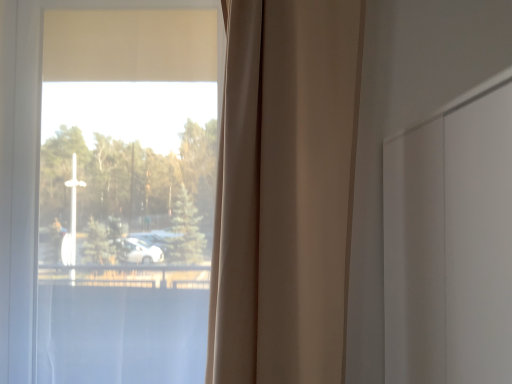
What do you see at coordinates (29, 166) in the screenshot?
I see `transparent glass window at center` at bounding box center [29, 166].

What is the approximate height of transparent glass window at center?

It is 4.28 feet.

The height and width of the screenshot is (384, 512). Find the location of `transparent glass window at center`. transparent glass window at center is located at coordinates (29, 166).

In order to click on beige fabric curtain at center in this screenshot , I will do `click(285, 191)`.

What do you see at coordinates (285, 191) in the screenshot? I see `beige fabric curtain at center` at bounding box center [285, 191].

What is the approximate height of beige fabric curtain at center?

The height of beige fabric curtain at center is 1.19 meters.

Identify the location of transparent glass window at center. (29, 166).

Is transparent glass window at center to the left of beige fabric curtain at center from the viewer's perspective?

Indeed, transparent glass window at center is positioned on the left side of beige fabric curtain at center.

Is transparent glass window at center closer to camera compared to beige fabric curtain at center?

No, it is not.

Is point (33, 331) closer or farther from the camera than point (331, 14)?

Point (33, 331) appears to be farther away from the viewer than point (331, 14).

Looking at this image, from the image's perspective, is transparent glass window at center below beige fabric curtain at center?

Yes, from the image's perspective, transparent glass window at center is beneath beige fabric curtain at center.

From a real-world perspective, is transparent glass window at center below beige fabric curtain at center?

Correct, in the physical world, transparent glass window at center is lower than beige fabric curtain at center.

Is transparent glass window at center wider than beige fabric curtain at center?

Correct, the width of transparent glass window at center exceeds that of beige fabric curtain at center.

In the scene shown: Considering the relative sizes of transparent glass window at center and beige fabric curtain at center in the image provided, is transparent glass window at center shorter than beige fabric curtain at center?

No, transparent glass window at center is not shorter than beige fabric curtain at center.

Can you confirm if transparent glass window at center is bigger than beige fabric curtain at center?

Yes.

In the scene shown: Is beige fabric curtain at center located within transparent glass window at center?

No, beige fabric curtain at center is not a part of transparent glass window at center.

Is transparent glass window at center not close to beige fabric curtain at center?

No, there isn't a large distance between transparent glass window at center and beige fabric curtain at center.

Does transparent glass window at center turn towards beige fabric curtain at center?

No, transparent glass window at center does not turn towards beige fabric curtain at center.

In the image, there is a transparent glass window at center. Where is `curtain above it (from the image's perspective)`? The width and height of the screenshot is (512, 384). curtain above it (from the image's perspective) is located at coordinates (285, 191).

Between beige fabric curtain at center and transparent glass window at center, which one appears on the right side from the viewer's perspective?

From the viewer's perspective, beige fabric curtain at center appears more on the right side.

Based on the photo, considering the positions of objects beige fabric curtain at center and transparent glass window at center in the image provided, who is in front, beige fabric curtain at center or transparent glass window at center?

beige fabric curtain at center is more forward.

In the scene shown: Which is farther from the camera, (282, 329) or (24, 168)?

The point (24, 168) is farther from the camera.

In the scene shown: From the image's perspective, is beige fabric curtain at center above or below transparent glass window at center?

From the image's perspective, beige fabric curtain at center appears above transparent glass window at center.

From a real-world perspective, is beige fabric curtain at center physically located above or below transparent glass window at center?

From a real-world perspective, beige fabric curtain at center is physically above transparent glass window at center.

Considering the sizes of objects beige fabric curtain at center and transparent glass window at center in the image provided, who is thinner, beige fabric curtain at center or transparent glass window at center?

beige fabric curtain at center is thinner.

Between beige fabric curtain at center and transparent glass window at center, which one has more height?

transparent glass window at center is taller.

Who is smaller, beige fabric curtain at center or transparent glass window at center?

beige fabric curtain at center.

Choose the correct answer: Is beige fabric curtain at center inside transparent glass window at center or outside it?

beige fabric curtain at center is located beyond the bounds of transparent glass window at center.

Is there a large distance between beige fabric curtain at center and transparent glass window at center?

No, beige fabric curtain at center is in close proximity to transparent glass window at center.

Is beige fabric curtain at center facing towards transparent glass window at center?

No, beige fabric curtain at center is not turned towards transparent glass window at center.

Can you tell me how much beige fabric curtain at center and transparent glass window at center differ in facing direction?

8.32e-06 degrees.

Where is `curtain that is in front of the transparent glass window at center`? The image size is (512, 384). curtain that is in front of the transparent glass window at center is located at coordinates (285, 191).

What are the coordinates of `curtain that is above the transparent glass window at center (from a real-world perspective)` in the screenshot? It's located at (x=285, y=191).

Where is `curtain that appears on the right of transparent glass window at center`? The width and height of the screenshot is (512, 384). curtain that appears on the right of transparent glass window at center is located at coordinates (285, 191).